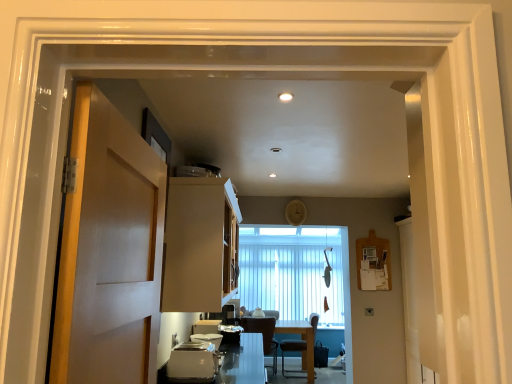
Question: Is satin silver toaster at lower center oriented away from wooden chair at center, which appears as the 2th chair when viewed from the right?

Choices:
 (A) yes
 (B) no

Answer: (B)

Question: Is satin silver toaster at lower center outside wooden chair at center, the first chair from the left?

Choices:
 (A) yes
 (B) no

Answer: (A)

Question: Could you tell me if satin silver toaster at lower center is facing wooden chair at center, the first chair from the left?

Choices:
 (A) yes
 (B) no

Answer: (B)

Question: Does satin silver toaster at lower center have a smaller size compared to wooden chair at center, which appears as the 2th chair when viewed from the right?

Choices:
 (A) yes
 (B) no

Answer: (A)

Question: Is satin silver toaster at lower center closer to the viewer compared to wooden chair at center, the first chair from the left?

Choices:
 (A) yes
 (B) no

Answer: (A)

Question: Is satin silver toaster at lower center shorter than wooden chair at center, which appears as the 2th chair when viewed from the right?

Choices:
 (A) yes
 (B) no

Answer: (A)

Question: Is wooden chair at center, the first chair from the left, turned away from white glossy countertop at lower center?

Choices:
 (A) no
 (B) yes

Answer: (B)

Question: Is wooden chair at center, the first chair from the left, smaller than white glossy countertop at lower center?

Choices:
 (A) no
 (B) yes

Answer: (A)

Question: Is wooden chair at center, the first chair from the left, shorter than white glossy countertop at lower center?

Choices:
 (A) no
 (B) yes

Answer: (A)

Question: Is the depth of wooden chair at center, which appears as the 2th chair when viewed from the right, less than that of white glossy countertop at lower center?

Choices:
 (A) no
 (B) yes

Answer: (A)

Question: From the image's perspective, is wooden chair at center, which appears as the 2th chair when viewed from the right, located above white glossy countertop at lower center?

Choices:
 (A) yes
 (B) no

Answer: (B)

Question: From the image's perspective, does wooden chair at center, which appears as the 2th chair when viewed from the right, appear lower than white glossy countertop at lower center?

Choices:
 (A) yes
 (B) no

Answer: (A)

Question: Is white glossy countertop at lower center not inside satin silver toaster at lower center?

Choices:
 (A) yes
 (B) no

Answer: (A)